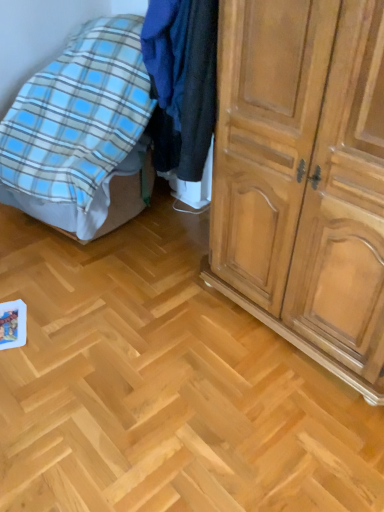
Identify the location of vacant space that is to the left of light brown wooden cupboard at right. (150, 328).